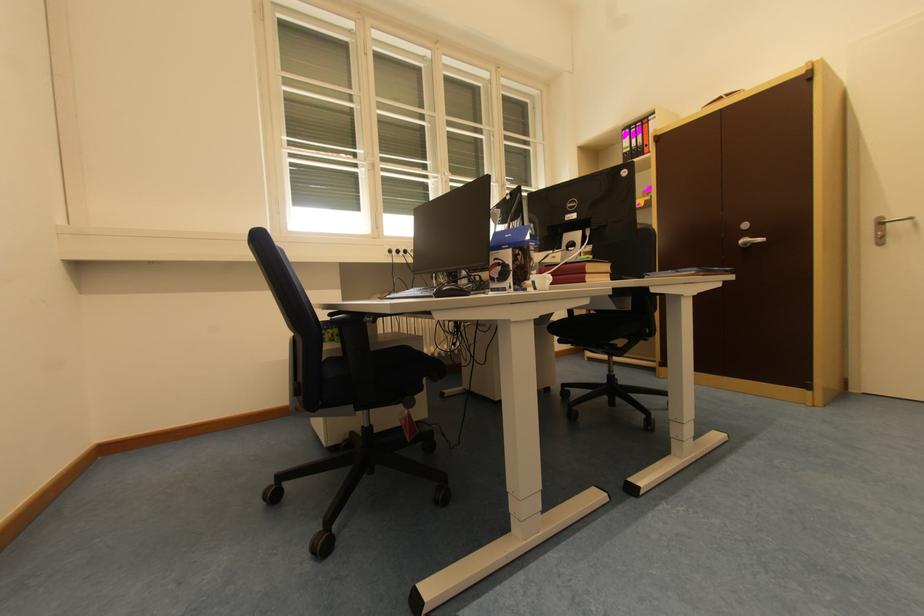
You are a GUI agent. You are given a task and a screenshot of the screen. Output one action in this format:
    pyautogui.click(x=<x>, y=<y>)
    Task: Click on the silver door handle
    
    Given the screenshot: What is the action you would take?
    pyautogui.click(x=889, y=220)